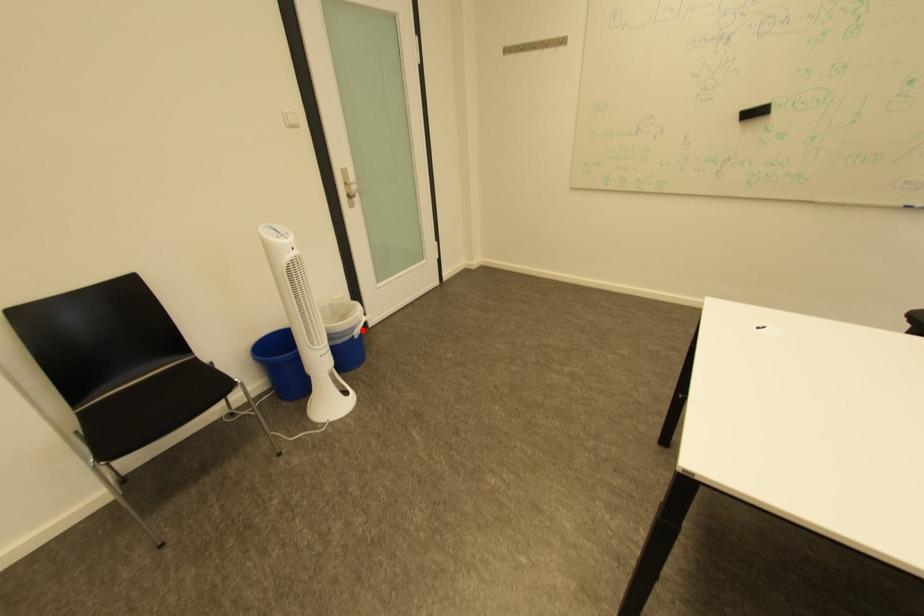
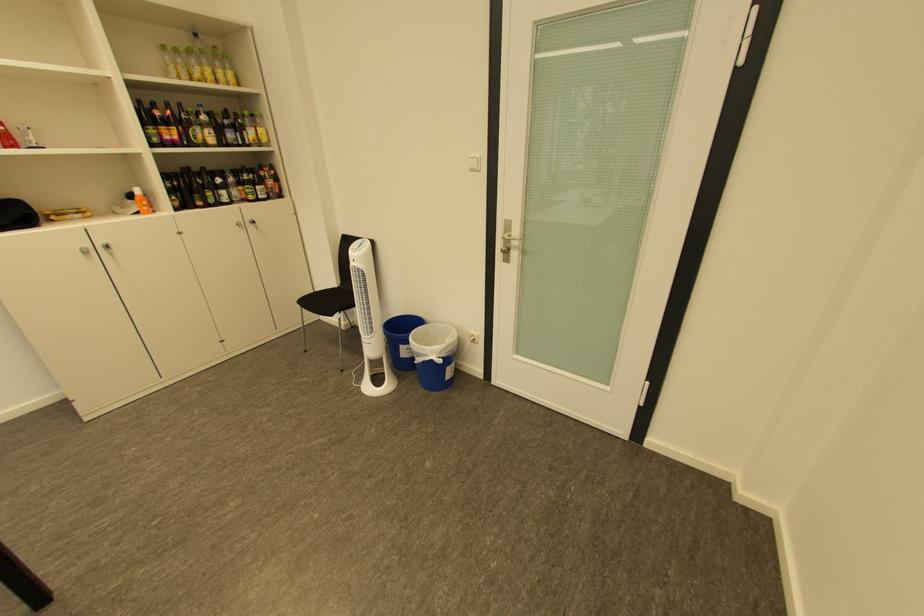
Question: I am providing you with two images of the same scene from different viewpoints. Image1 has a red point marked. In image2, the corresponding 3D location appears at what relative position? Reply with the corresponding letter.

Choices:
 (A) Closer
 (B) Farther

Answer: (B)